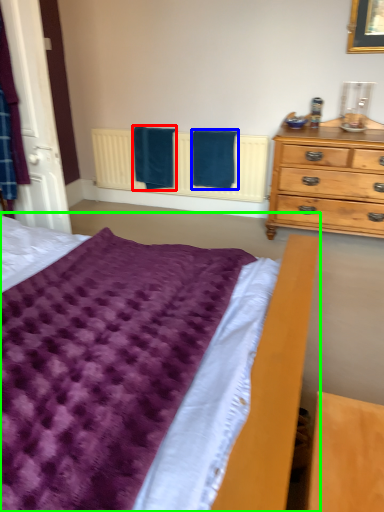
Question: Estimate the real-world distances between objects in this image. Which object is farther from bath towel (highlighted by a red box), bath towel (highlighted by a blue box) or bed (highlighted by a green box)?

Choices:
 (A) bath towel
 (B) bed

Answer: (B)